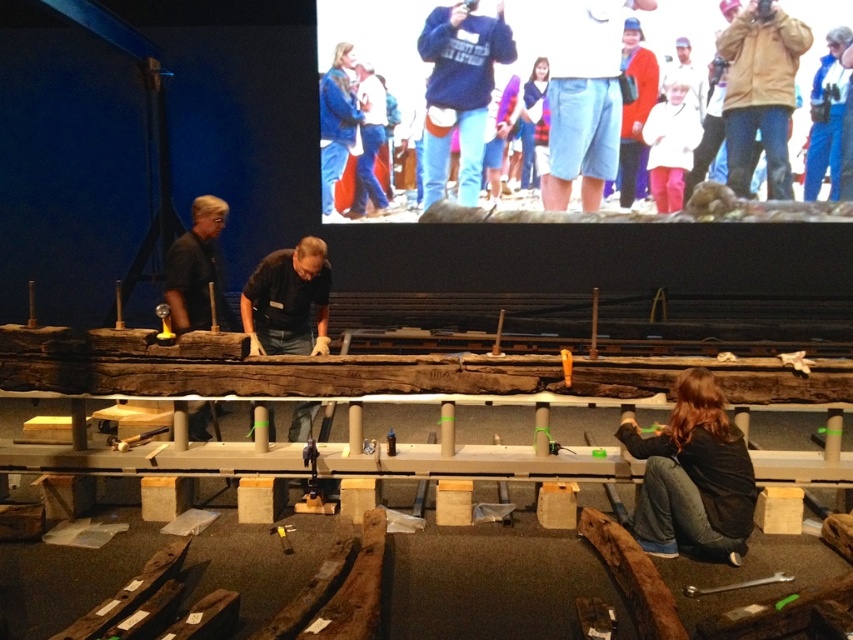
You are standing in the museum and see two points marked on the wooden planks. The first point is at coordinates point (x=328, y=186) and the second is at point (x=631, y=176). Which point is closer to you?

Point (x=328, y=186) is closer to you because it is further to the viewer than point (x=631, y=176).

You are an observer in the museum looking at the blue denim jeans at upper center and the matte red sweater at upper right. Which object takes up more space in the scene?

The blue denim jeans at upper center takes up more space in the scene because it is larger in size than the matte red sweater at upper right.